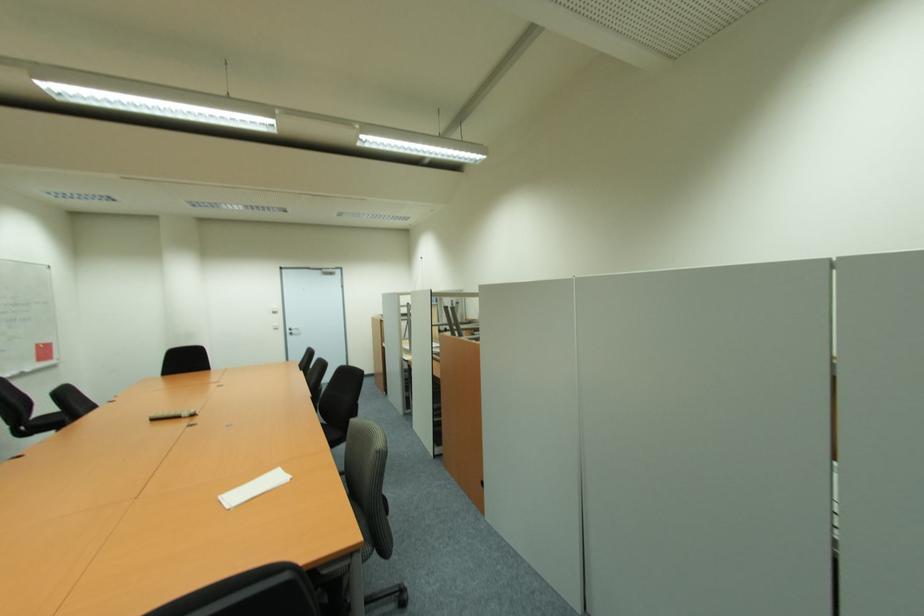
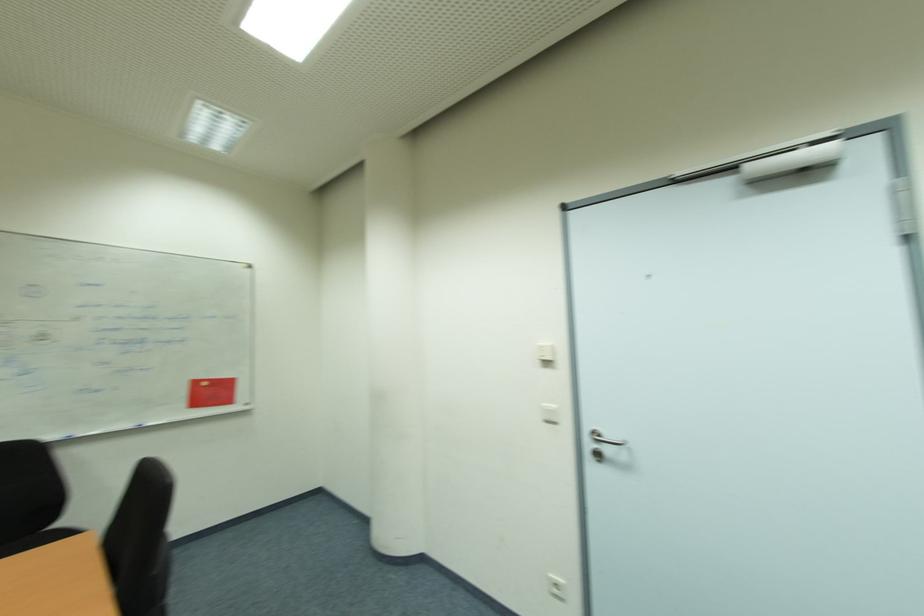
Find the pixel in the second image that matches the point at 282,325 in the first image.

(556, 407)